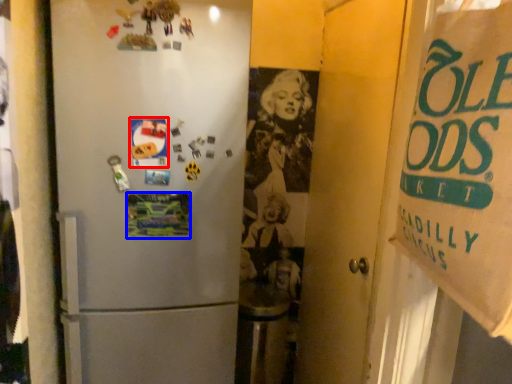
Question: Which of the following is the closest to the observer, postcard (highlighted by a red box) or postcard (highlighted by a blue box)?

Choices:
 (A) postcard
 (B) postcard

Answer: (A)